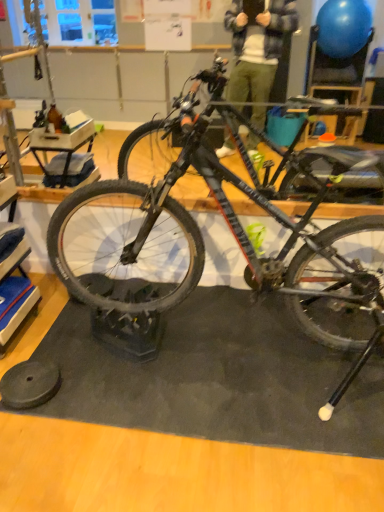
You are a GUI agent. You are given a task and a screenshot of the screen. Output one action in this format:
    pyautogui.click(x=<x>, y=<y>)
    Task: Click on the free point below matte black bicycle at center (from a real-world perspective)
    The image size is (384, 512).
    Given the screenshot: What is the action you would take?
    pyautogui.click(x=225, y=343)